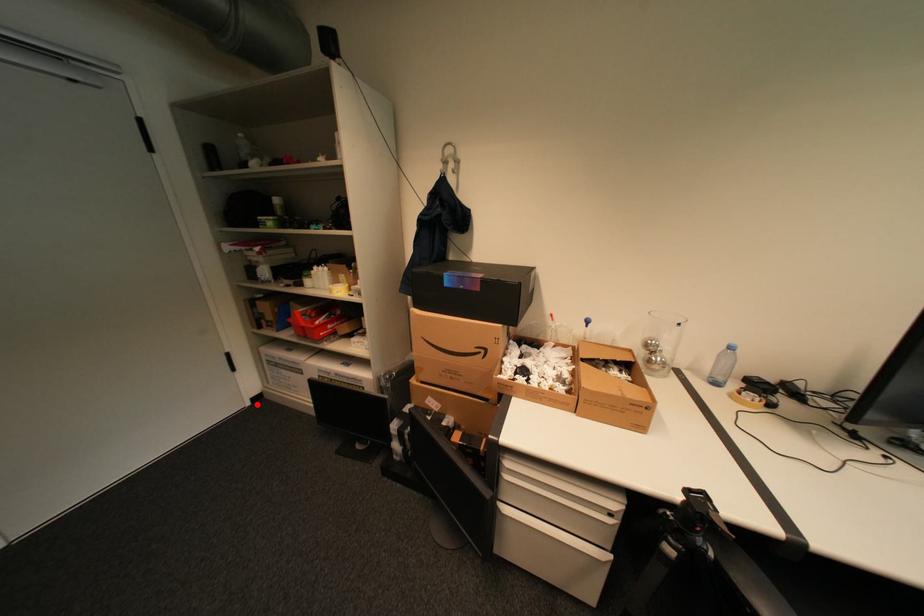
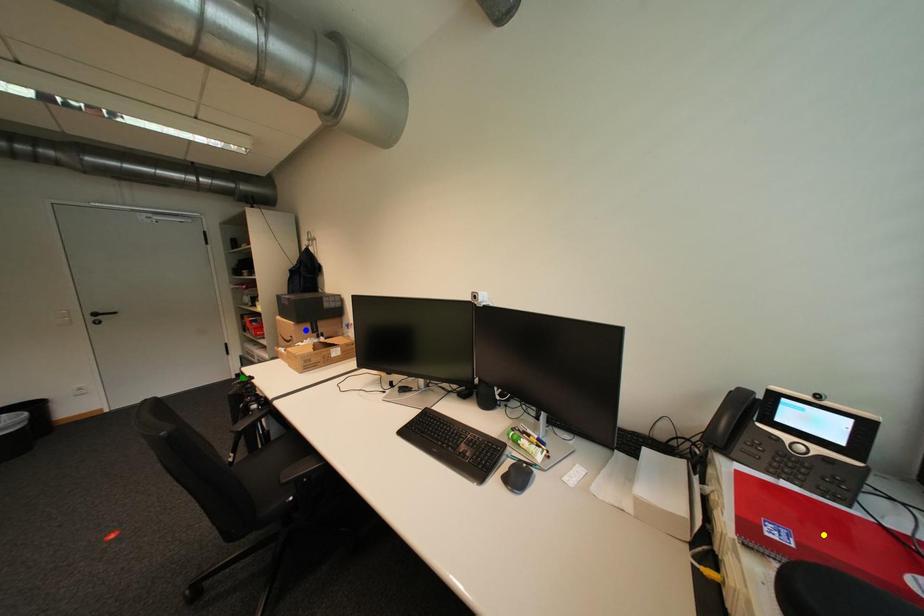
Question: I am providing you with two images of the same scene from different viewpoints. A red point is marked on the first image. You are given multiple points on the second image. Which mark in image 2 goes with the point in image 1?

Choices:
 (A) blue point
 (B) yellow point
 (C) green point

Answer: (C)